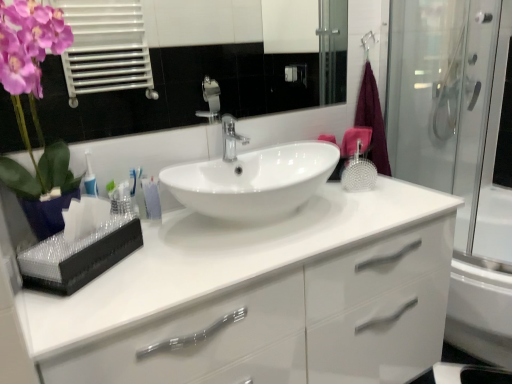
Question: From their relative heights in the image, would you say translucent plastic toothbrushes at left is taller or shorter than glossy ceramic mirror at upper center?

Choices:
 (A) short
 (B) tall

Answer: (A)

Question: From a real-world perspective, is translucent plastic toothbrushes at left physically located above or below glossy ceramic mirror at upper center?

Choices:
 (A) below
 (B) above

Answer: (A)

Question: Which of these objects is positioned closest to the glossy ceramic mirror at upper center?

Choices:
 (A) maroon fabric bath towel at right
 (B) polished chrome faucet at center
 (C) white glossy sink at center
 (D) white glossy cabinet at center
 (E) transparent glass shower door at right

Answer: (E)

Question: Which object is the farthest from the white glossy cabinet at center?

Choices:
 (A) maroon fabric bath towel at right
 (B) glossy ceramic mirror at upper center
 (C) translucent plastic toothbrushes at left
 (D) transparent glass shower door at right
 (E) white glossy sink at center

Answer: (B)